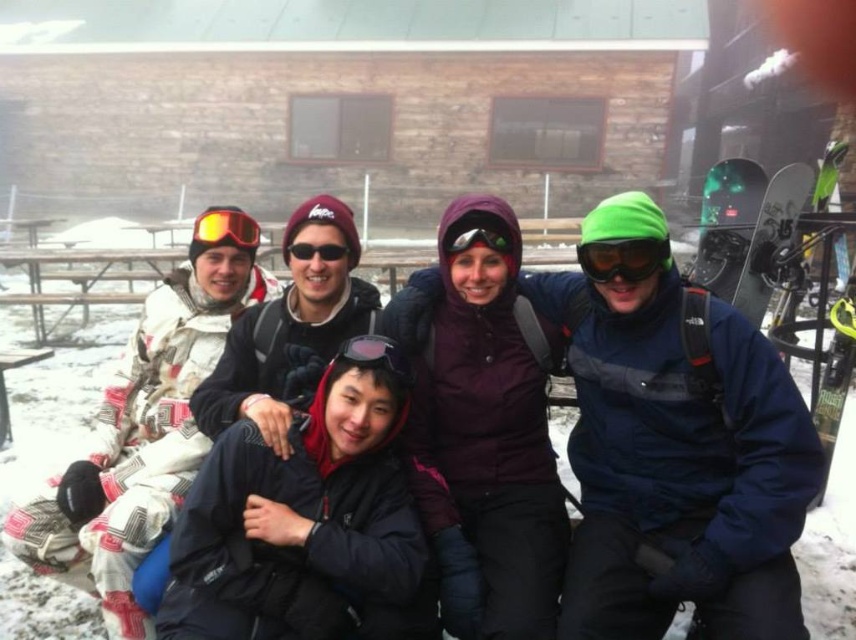
You are a photographer trying to capture a closeup shot of the goggles in the image. The green matte goggles at center and the black matte goggles at center are both in focus. Which pair of goggles would require a wider aperture setting to ensure proper focus due to their size?

The green matte goggles at center would require a wider aperture setting because their width is larger than the black matte goggles at center, necessitating a larger depth of field to capture the entire object in focus.

You are a photographer trying to capture a clear shot of the matte yellow goggles at upper left and the matte black goggles at center. Since you want both to be in focus, you need to know their height difference. Which goggles are taller?

The matte yellow goggles at upper left is much taller than the matte black goggles at center.